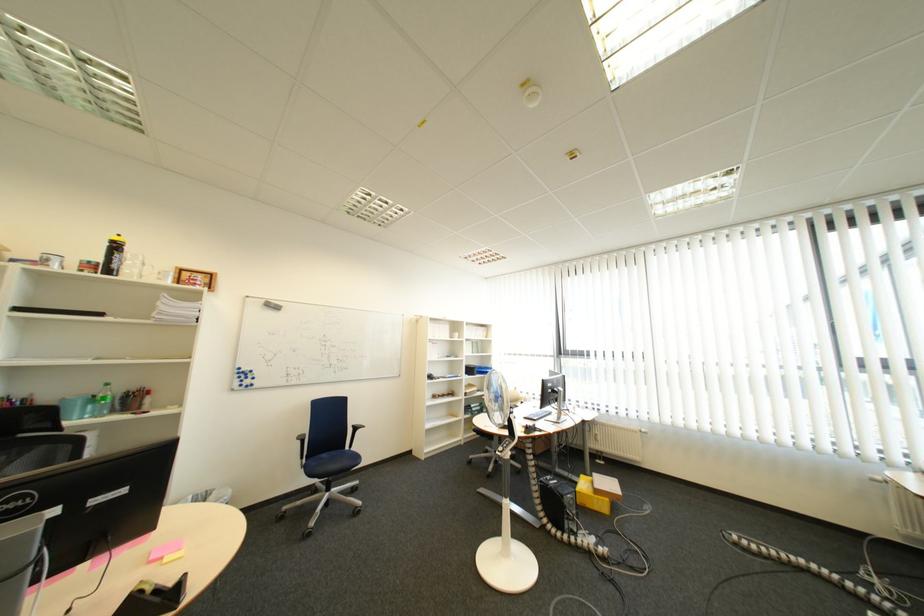
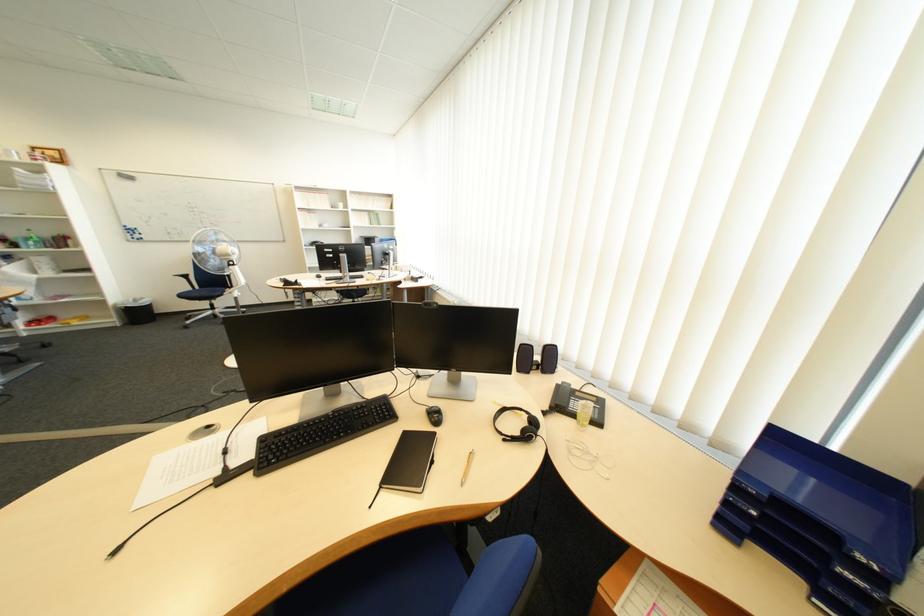
Question: I am providing you with two images of the same scene from different viewpoints. Which of the following objects are not visible in image2?

Choices:
 (A) green plastic bottle
 (B) black computer mouse
 (C) blue shoe box
 (D) clear eyeglasses

Answer: (B)